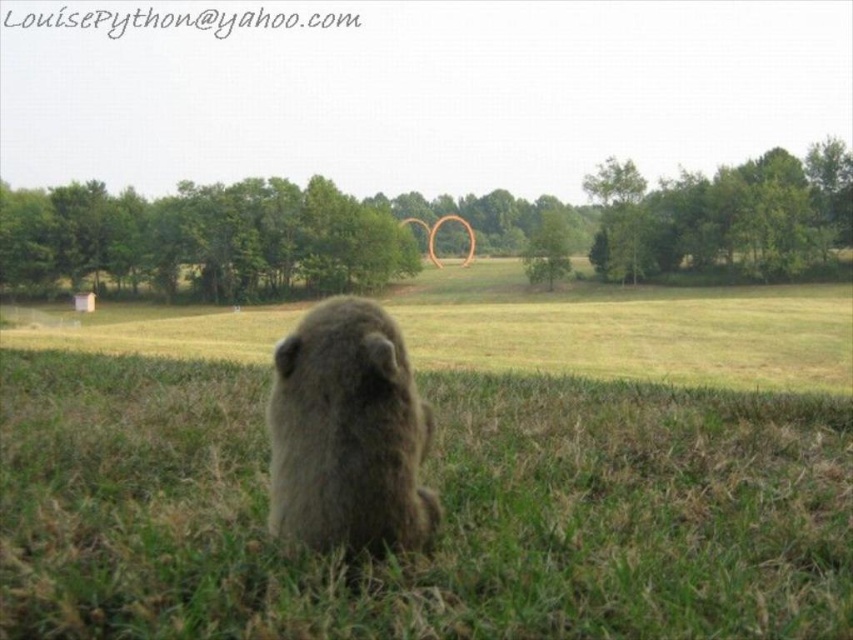
Question: Does green grass at center appear on the left side of fuzzy brown groundhog at center?

Choices:
 (A) yes
 (B) no

Answer: (B)

Question: Which of the following is the farthest from the observer?

Choices:
 (A) green grass at center
 (B) fuzzy brown groundhog at center

Answer: (B)

Question: Can you confirm if green grass at center is positioned to the right of fuzzy brown groundhog at center?

Choices:
 (A) no
 (B) yes

Answer: (B)

Question: Does green grass at center come in front of fuzzy brown groundhog at center?

Choices:
 (A) no
 (B) yes

Answer: (B)